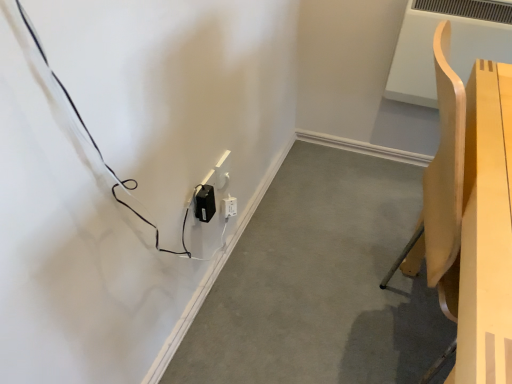
Question: Is light wood chair at right positioned beyond the bounds of black plastic power adapter at lower center, the second electric outlet when ordered from back to front?

Choices:
 (A) no
 (B) yes

Answer: (B)

Question: Considering the relative sizes of light wood chair at right and black plastic power adapter at lower center, the 1th electric outlet when ordered from front to back, in the image provided, is light wood chair at right taller than black plastic power adapter at lower center, the 1th electric outlet when ordered from front to back,?

Choices:
 (A) no
 (B) yes

Answer: (B)

Question: Is the depth of light wood chair at right less than that of black plastic power adapter at lower center, the 1th electric outlet when ordered from front to back?

Choices:
 (A) no
 (B) yes

Answer: (B)

Question: Does light wood chair at right appear on the left side of black plastic power adapter at lower center, the second electric outlet when ordered from back to front?

Choices:
 (A) no
 (B) yes

Answer: (A)

Question: Is light wood chair at right placed right next to black plastic power adapter at lower center, the 1th electric outlet when ordered from front to back?

Choices:
 (A) yes
 (B) no

Answer: (B)

Question: Is light wood chair at right smaller than black plastic power adapter at lower center, the 1th electric outlet when ordered from front to back?

Choices:
 (A) yes
 (B) no

Answer: (B)

Question: Could light wood chair at right be considered to be inside black plastic power adapter at lower left?

Choices:
 (A) yes
 (B) no

Answer: (B)

Question: Would you say black plastic power adapter at lower left is outside light wood chair at right?

Choices:
 (A) yes
 (B) no

Answer: (A)

Question: From a real-world perspective, is black plastic power adapter at lower left under light wood chair at right?

Choices:
 (A) no
 (B) yes

Answer: (B)

Question: From the image's perspective, does black plastic power adapter at lower left appear lower than light wood chair at right?

Choices:
 (A) yes
 (B) no

Answer: (A)

Question: From a real-world perspective, is black plastic power adapter at lower left on top of light wood chair at right?

Choices:
 (A) no
 (B) yes

Answer: (A)

Question: Is black plastic power adapter at lower left taller than light wood chair at right?

Choices:
 (A) no
 (B) yes

Answer: (A)

Question: Does black plastic power adapter at lower left have a larger size compared to white plastic electric outlet at center, arranged as the 2th electric outlet when viewed from the front?

Choices:
 (A) no
 (B) yes

Answer: (B)